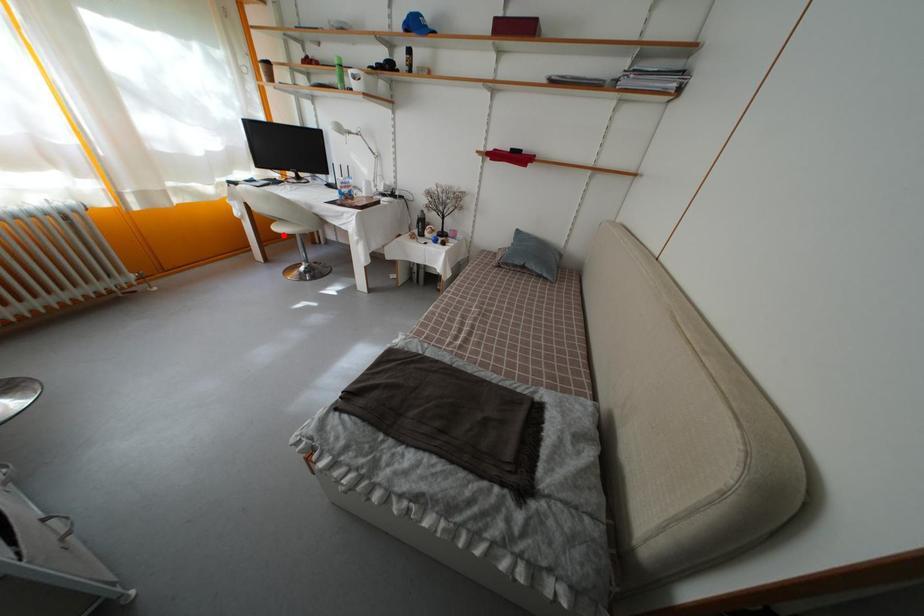
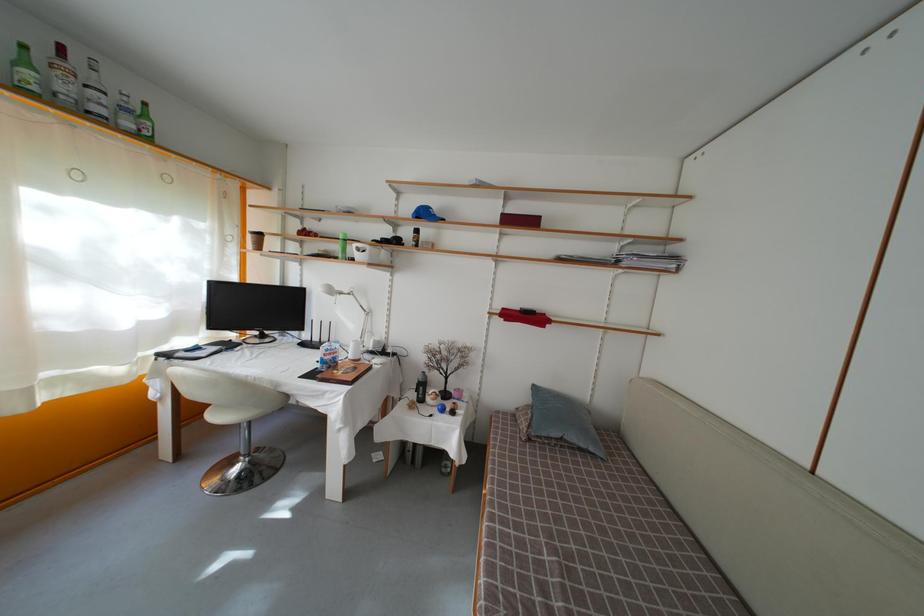
Find the pixel in the second image that matches the highlighted location in the first image.

(221, 422)